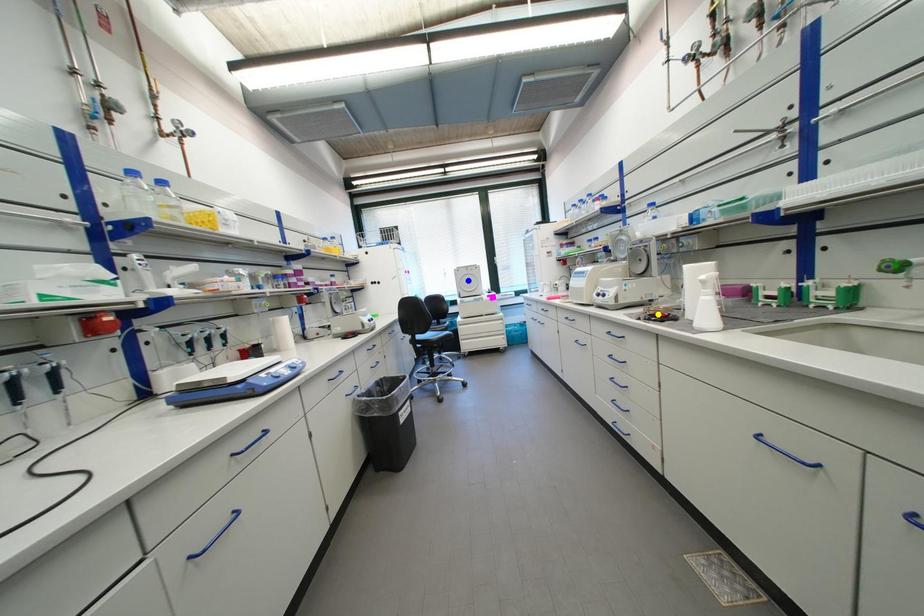
Order these from farthest to nearest:
- green point
- yellow point
- blue point

blue point < yellow point < green point